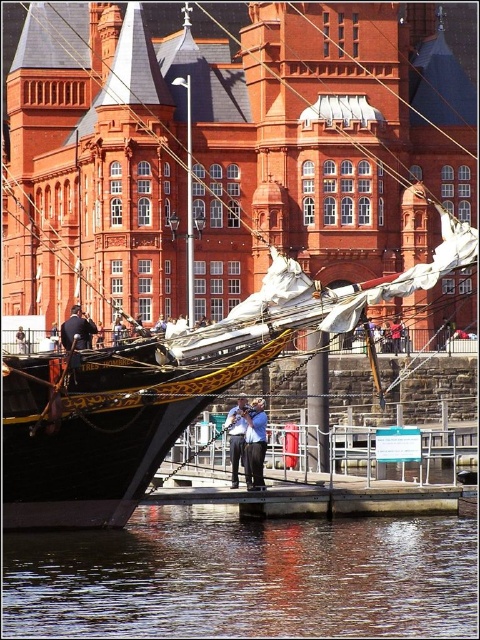
Can you confirm if blue shirt at center is positioned above dark blue jeans at lower left?

No, blue shirt at center is not above dark blue jeans at lower left.

Can you confirm if blue shirt at center is bigger than dark blue jeans at lower left?

Actually, blue shirt at center might be smaller than dark blue jeans at lower left.

Is point (240, 406) in front of point (64, 349)?

That is True.

Where is `blue shirt at center`? blue shirt at center is located at coordinates (237, 436).

Does smooth reflective water at lower center appear on the left side of blue fabric shirt at center?

Correct, you'll find smooth reflective water at lower center to the left of blue fabric shirt at center.

Based on the photo, is smooth reflective water at lower center in front of blue fabric shirt at center?

Yes, it is.

At what (x,y) coordinates should I click in order to perform the action: click on smooth reflective water at lower center. Please return your answer as a coordinate pair (x, y). Looking at the image, I should click on (244, 577).

You are a GUI agent. You are given a task and a screenshot of the screen. Output one action in this format:
    pyautogui.click(x=<x>, y=<y>)
    Task: Click on the smooth reflective water at lower center
    
    Given the screenshot: What is the action you would take?
    pyautogui.click(x=244, y=577)

Can you confirm if blue fabric shirt at center is positioned to the left of blue shirt at center?

No, blue fabric shirt at center is not to the left of blue shirt at center.

Does point (254, 406) come closer to viewer compared to point (230, 483)?

No, it is not.

The height and width of the screenshot is (640, 480). I want to click on blue fabric shirt at center, so click(x=254, y=444).